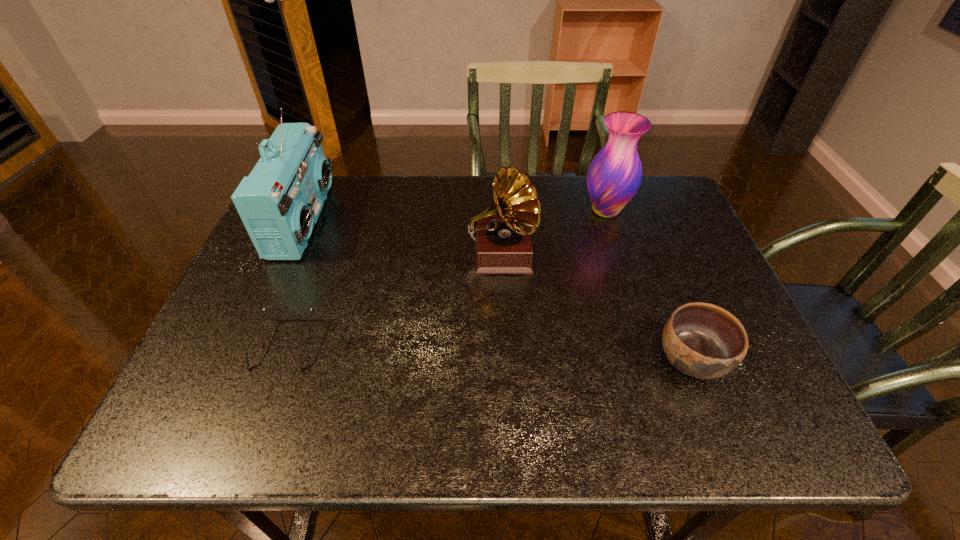
In the image, there is a desktop. At what (x,y) coordinates should I click in order to perform the action: click on vacant space at the left edge. Please return your answer as a coordinate pair (x, y). The image size is (960, 540). Looking at the image, I should click on (248, 296).

Locate an element on the screen. vacant space at the far right corner is located at coordinates (655, 217).

The image size is (960, 540). Identify the location of vacant space in between the vase and the bowl. tap(648, 285).

Locate an element on the screen. The image size is (960, 540). free point between the second shortest object and the spectacles is located at coordinates (488, 352).

Find the location of a particular element. The height and width of the screenshot is (540, 960). empty space between the vase and the bowl is located at coordinates (648, 285).

Locate an element on the screen. Image resolution: width=960 pixels, height=540 pixels. free area in between the vase and the shortest object is located at coordinates (445, 277).

Where is `free space between the radio receiver and the phonograph record`? free space between the radio receiver and the phonograph record is located at coordinates (402, 238).

Image resolution: width=960 pixels, height=540 pixels. I want to click on free space between the shortest object and the vase, so click(x=445, y=277).

Image resolution: width=960 pixels, height=540 pixels. I want to click on free space between the vase and the shortest object, so click(445, 277).

The width and height of the screenshot is (960, 540). In order to click on vacant region between the radio receiver and the phonograph record in this screenshot , I will do `click(402, 238)`.